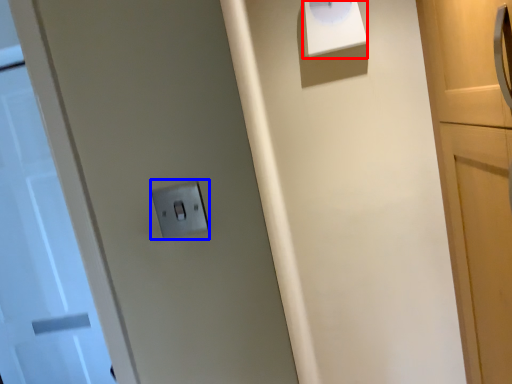
Question: Which point is further to the camera, wide (highlighted by a red box) or light switch (highlighted by a blue box)?

Choices:
 (A) wide
 (B) light switch

Answer: (A)